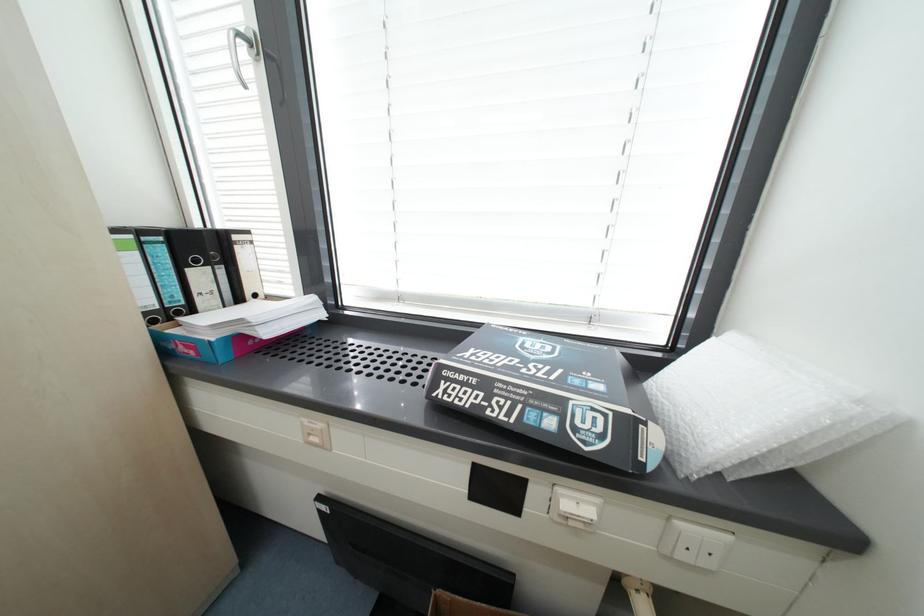
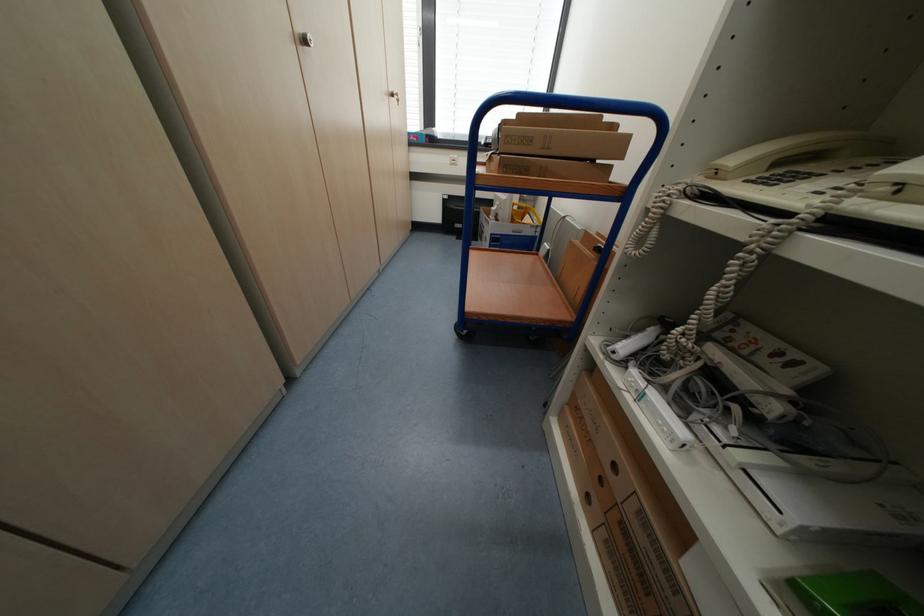
Consider the image. Which direction would the cameraman need to move to produce the second image?

The cameraman moved toward left, backward.